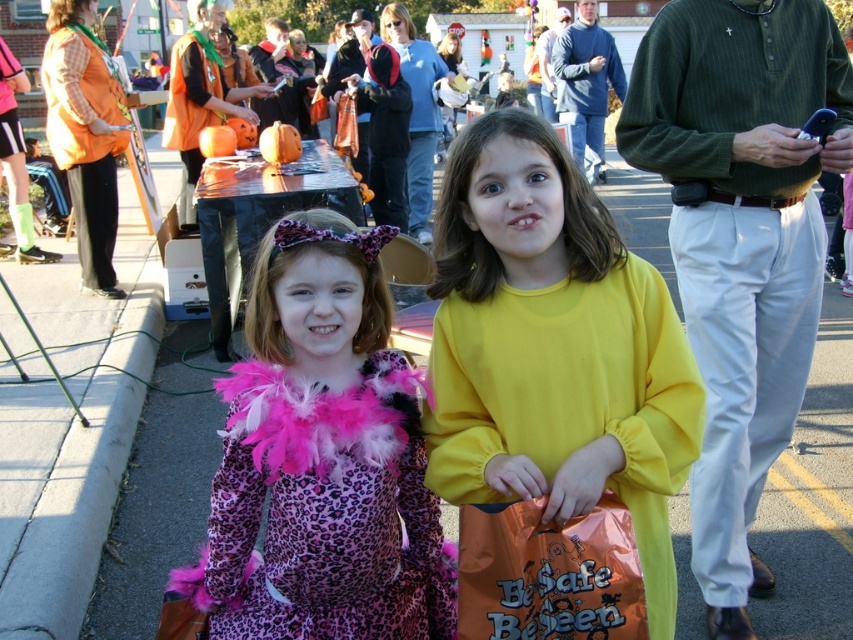
Consider the image. Does purple leopard print dress at center have a larger size compared to green knit sweater at upper right?

No.

Does point (321, 518) come closer to viewer compared to point (578, 22)?

Yes, point (321, 518) is in front of point (578, 22).

Image resolution: width=853 pixels, height=640 pixels. Find the location of `purple leopard print dress at center`. purple leopard print dress at center is located at coordinates (322, 513).

Is point (798, 102) farther from viewer compared to point (550, 120)?

No, it is not.

Is green pinstripe sweater at upper right wider than green textured sweater at upper right?

No, green pinstripe sweater at upper right is not wider than green textured sweater at upper right.

Where is `green pinstripe sweater at upper right`? green pinstripe sweater at upper right is located at coordinates click(x=740, y=243).

This screenshot has height=640, width=853. I want to click on green pinstripe sweater at upper right, so click(x=740, y=243).

Consider the image. Who is lower down, orange fabric vest at left or green textured sweater at upper right?

orange fabric vest at left is lower down.

Which of these two, orange fabric vest at left or green textured sweater at upper right, stands taller?

green textured sweater at upper right is taller.

Image resolution: width=853 pixels, height=640 pixels. Describe the element at coordinates (85, 132) in the screenshot. I see `orange fabric vest at left` at that location.

Identify the location of orange fabric vest at left. (85, 132).